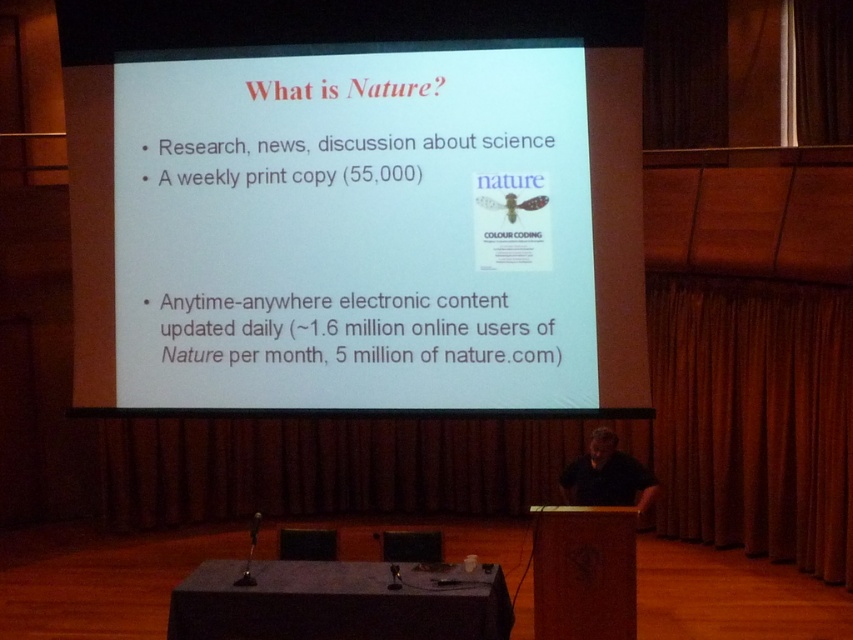
Question: Does white paper at center appear on the right side of black shirt at center?

Choices:
 (A) no
 (B) yes

Answer: (A)

Question: Among these points, which one is farthest from the camera?

Choices:
 (A) (115, 198)
 (B) (619, 468)

Answer: (B)

Question: Is white paper at center wider than black shirt at center?

Choices:
 (A) yes
 (B) no

Answer: (A)

Question: Among these points, which one is farthest from the camera?

Choices:
 (A) (177, 99)
 (B) (569, 496)

Answer: (B)

Question: Does white paper at center have a lesser width compared to black shirt at center?

Choices:
 (A) yes
 (B) no

Answer: (B)

Question: Among these objects, which one is nearest to the camera?

Choices:
 (A) black shirt at center
 (B) white paper at center

Answer: (B)